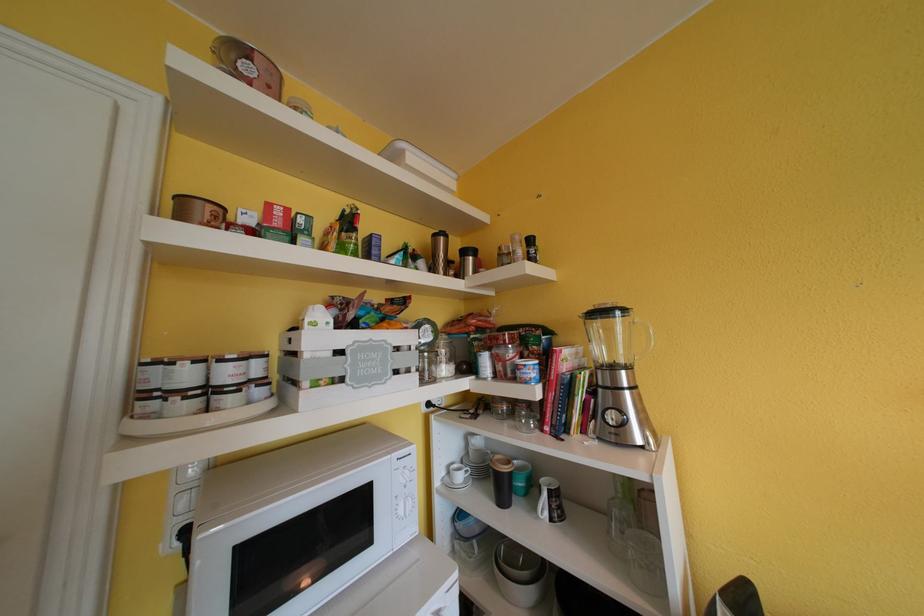
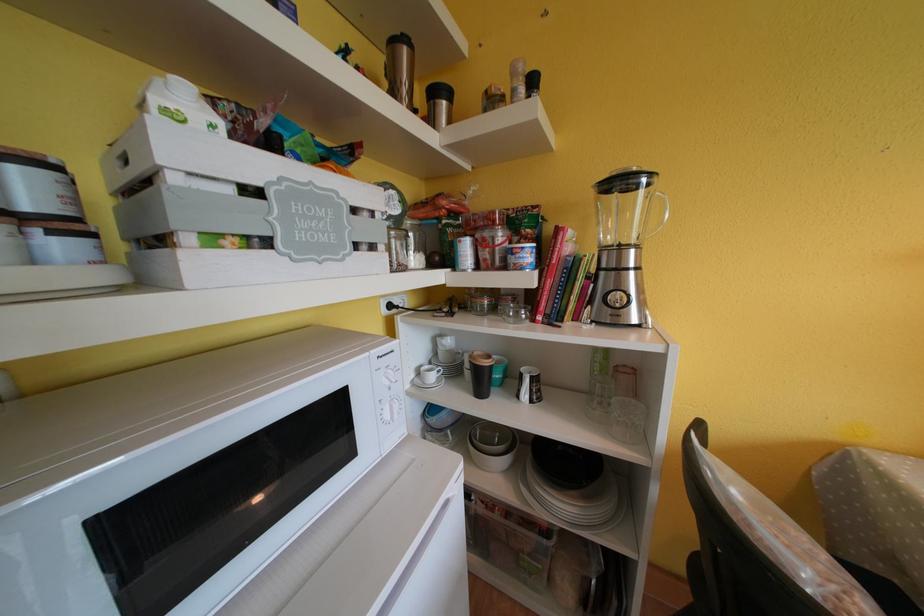
How did the camera likely rotate?

The rotation direction of the camera is right-down.